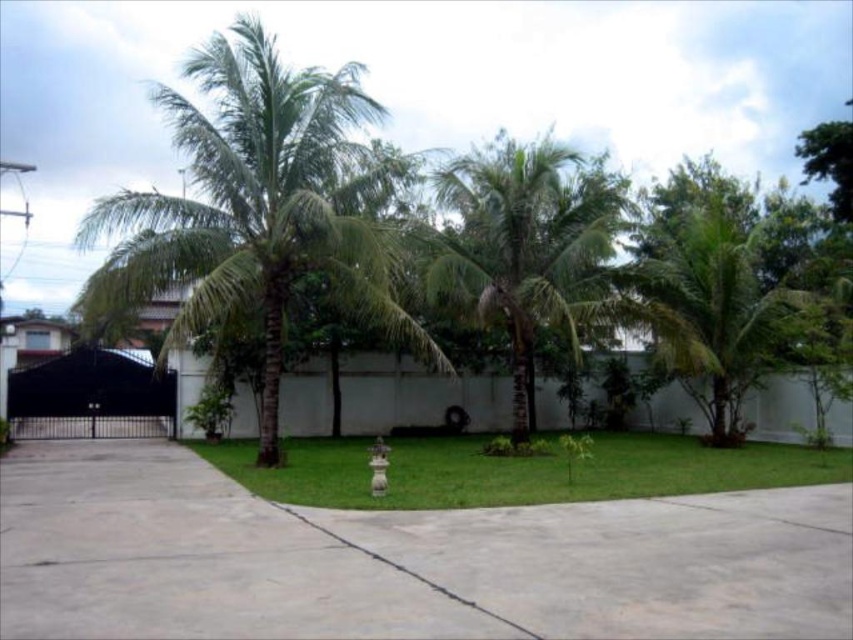
In the scene shown: You are designing a garden layout and need to place a narrow walkway between the green leafy palm tree at center and the green grass at center. Which object should the walkway be closer to to ensure it doesn

The walkway should be closer to the green leafy palm tree at center because it is thinner than the green grass at center, allowing more space for the wider grass area.

You are a gardener who needs to trim the green leafy palm tree at right. The gray concrete pavement at center is in your way. Can you walk around it to reach the tree?

The gray concrete pavement at center is taller than green leafy palm tree at right, so you cannot walk around it because the pavement is taller and likely blocks the path.